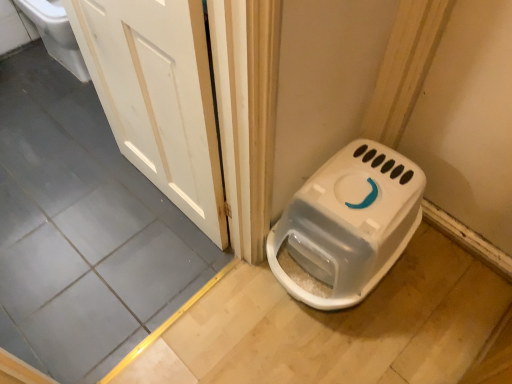
Question: Considering the relative positions of white wood door at upper left and white plastic litter box at lower right in the image provided, is white wood door at upper left to the left or to the right of white plastic litter box at lower right?

Choices:
 (A) left
 (B) right

Answer: (A)

Question: Is white wood door at upper left inside the boundaries of white plastic litter box at lower right, or outside?

Choices:
 (A) outside
 (B) inside

Answer: (A)

Question: In the image, is white wood door at upper left positioned in front of or behind white plastic litter box at lower right?

Choices:
 (A) front
 (B) behind

Answer: (A)

Question: Considering their positions, is white plastic litter box at lower right located in front of or behind white wood door at upper left?

Choices:
 (A) behind
 (B) front

Answer: (A)

Question: Is white plastic litter box at lower right wider or thinner than white wood door at upper left?

Choices:
 (A) wide
 (B) thin

Answer: (A)

Question: Is point (350, 253) closer or farther from the camera than point (194, 86)?

Choices:
 (A) farther
 (B) closer

Answer: (A)

Question: From the image's perspective, is white plastic litter box at lower right positioned above or below white wood door at upper left?

Choices:
 (A) below
 (B) above

Answer: (A)